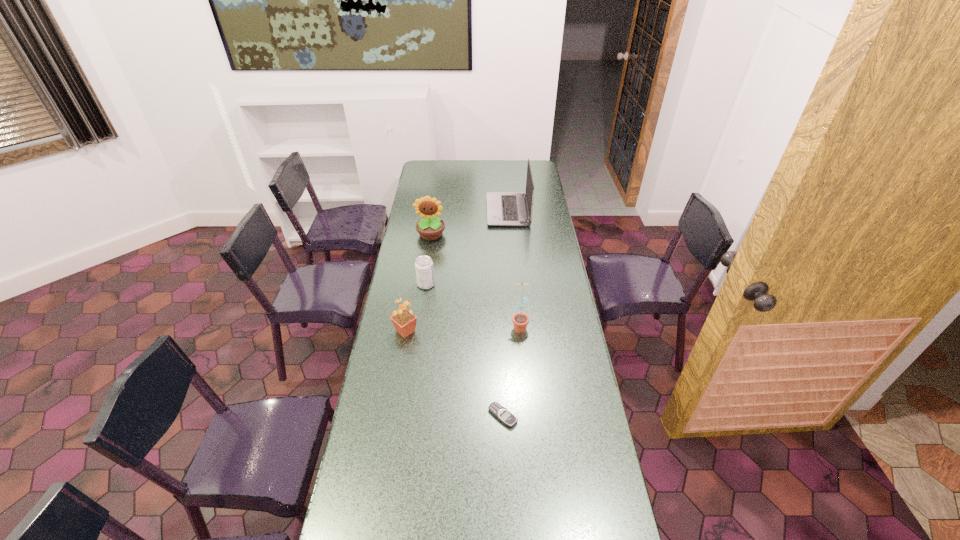
I want to click on laptop computer, so click(x=503, y=208).

Image resolution: width=960 pixels, height=540 pixels. Identify the location of the farthest sunflower. (430, 227).

Locate an element on the screen. The width and height of the screenshot is (960, 540). the rightmost sunflower is located at coordinates (520, 320).

At what (x,y) coordinates should I click in order to perform the action: click on the third farthest object. Please return your answer as a coordinate pair (x, y). Looking at the image, I should click on (424, 269).

Where is `soda can`? The height and width of the screenshot is (540, 960). soda can is located at coordinates (424, 269).

Image resolution: width=960 pixels, height=540 pixels. Identify the location of the nearest object. tap(505, 416).

Where is `the shortest object`? the shortest object is located at coordinates coord(505,416).

Locate an element on the screen. free space located on the screen of the laptop computer is located at coordinates (437, 211).

In order to click on vacant space located on the screen of the laptop computer in this screenshot , I will do `click(457, 211)`.

Where is `vacant region located on the screen of the laptop computer`? This screenshot has width=960, height=540. vacant region located on the screen of the laptop computer is located at coordinates (424, 211).